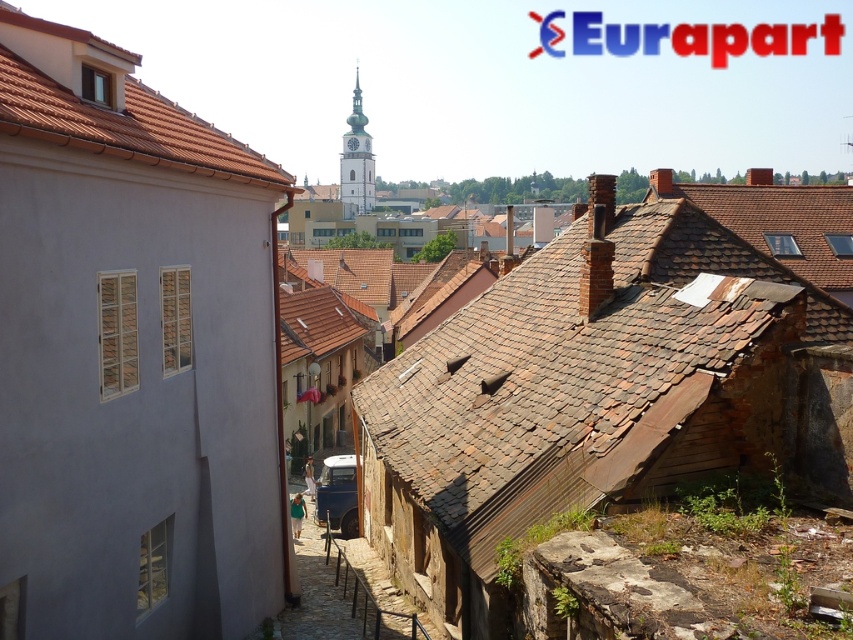
You are standing at the point marked as point (585, 380) in the image. What material do you see directly beneath your feet?

The material directly beneath your feet at point (585, 380) is brown shingles.

You are a construction worker assessing the materials in the image. The brown shingles at center and the smooth stone wall at center are both visible. Which material has a bigger surface area?

The brown shingles at center has a larger size compared to the smooth stone wall at center, so the brown shingles at center has a bigger surface area.

You are standing at the top of the cobblestone street looking down. There are two points marked on the ground in front of you. The first point is at coordinate (641, 324) and the second is at (108, 113). Which point is closer to your current position?

Point (641, 324) is closer to your current position because it is further to the viewer than point (108, 113).